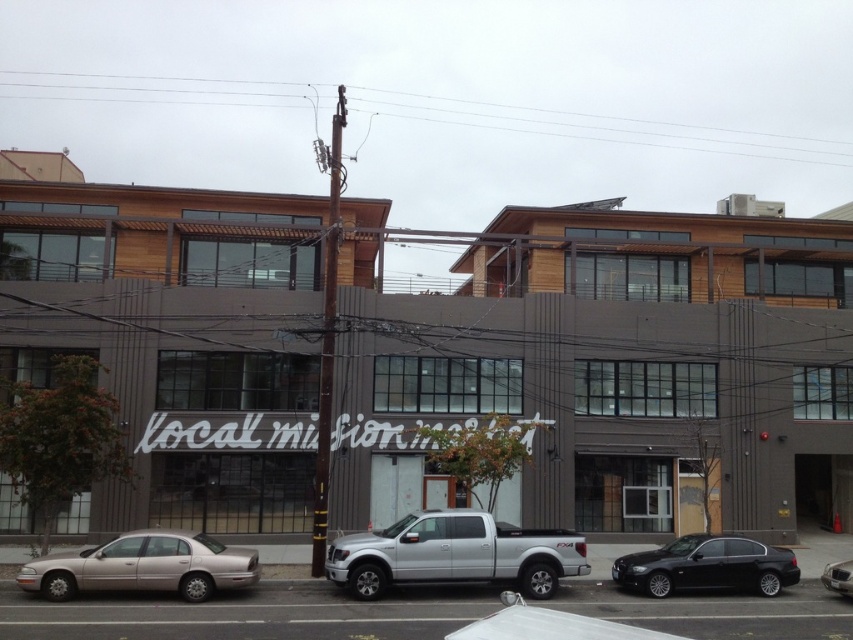
Who is lower down, silver metallic truck at lower center or silver metallic truck at center?

silver metallic truck at lower center is lower down.

Is silver metallic truck at lower center above silver metallic truck at center?

Actually, silver metallic truck at lower center is below silver metallic truck at center.

Is point (279, 612) more distant than point (537, 541)?

That is False.

Find the location of a particular element. silver metallic truck at lower center is located at coordinates (247, 614).

Locate an element on the screen. The height and width of the screenshot is (640, 853). silver metallic truck at center is located at coordinates (454, 554).

Between silver metallic truck at center and black metallic sedan at lower right, which one has more height?

→ silver metallic truck at center is taller.

Find the location of a particular element. silver metallic truck at center is located at coordinates (454, 554).

In order to click on silver metallic truck at lower center in this screenshot , I will do point(247,614).

Is silver metallic truck at lower center positioned behind black metallic sedan at lower right?

No, silver metallic truck at lower center is closer to the viewer.

What do you see at coordinates (247, 614) in the screenshot?
I see `silver metallic truck at lower center` at bounding box center [247, 614].

Find the location of a particular element. This screenshot has width=853, height=640. silver metallic truck at lower center is located at coordinates (247, 614).